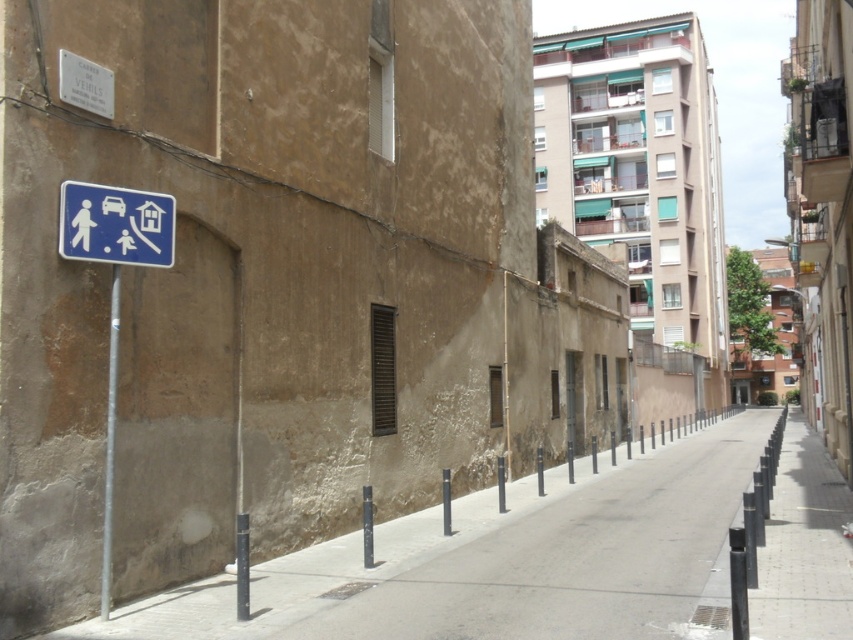
Can you confirm if blue plastic sign at upper left is positioned above metallic pole at left?

Yes, blue plastic sign at upper left is above metallic pole at left.

Where is `blue plastic sign at upper left`? blue plastic sign at upper left is located at coordinates (115, 225).

Locate an element on the screen. The image size is (853, 640). blue plastic sign at upper left is located at coordinates coord(115,225).